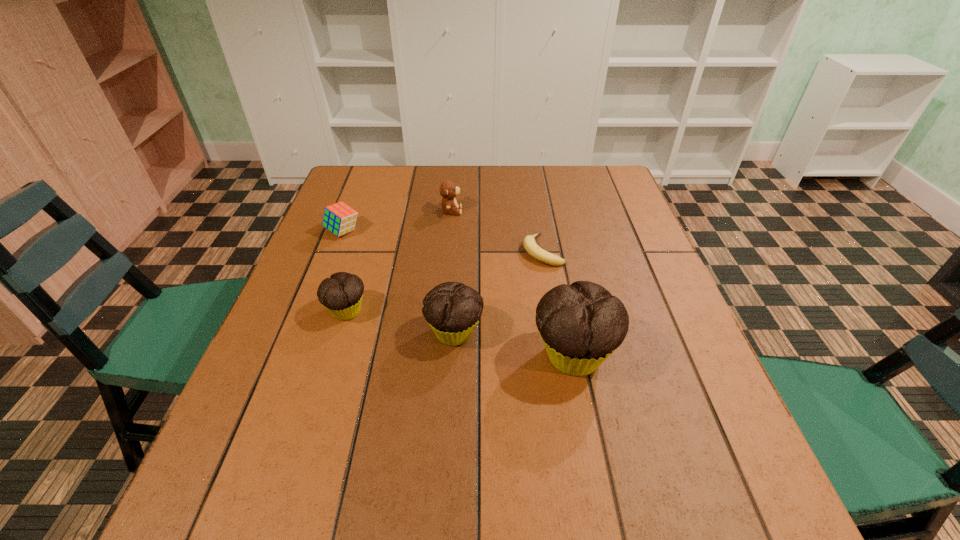
All muffins are currently evenly spaced. To continue this pattern, where would you add another muffin on the right? Please point out a vacant spot. Please provide its 2D coordinates. Your answer should be formatted as a tuple, i.e. [(x, y)], where the tuple contains the x and y coordinates of a point satisfying the conditions above.

[(706, 381)]